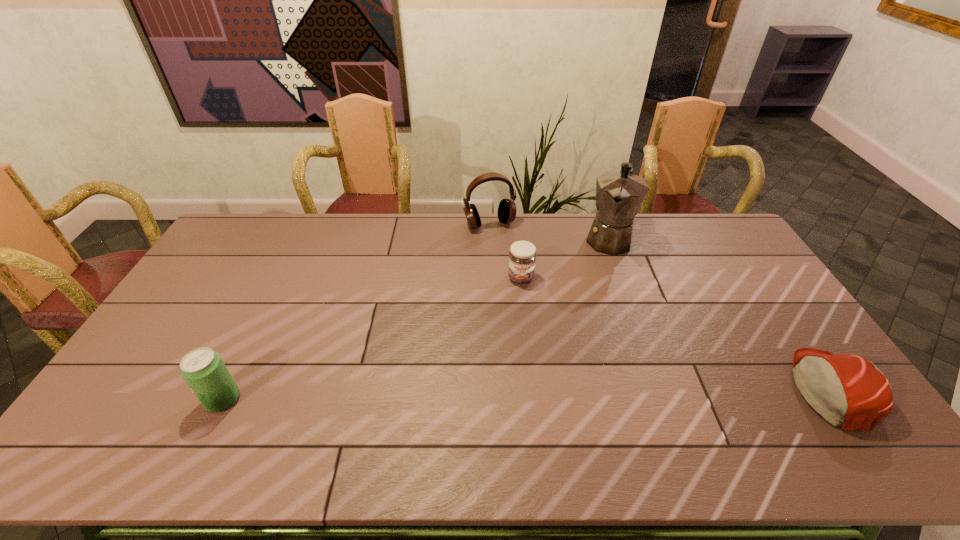
The height and width of the screenshot is (540, 960). I want to click on vacant space located 0.300m on the front label of the jam, so tap(529, 360).

The image size is (960, 540). What are the coordinates of `vacant region located 0.310m on the ear pads of the headset` in the screenshot? It's located at (523, 288).

I want to click on vacant space located on the ear pads of the headset, so click(x=532, y=305).

The width and height of the screenshot is (960, 540). What are the coordinates of `vacant area situated on the ear pads of the headset` in the screenshot? It's located at (521, 284).

Identify the location of free space located 0.050m on the pouring side of the tallest object. (604, 267).

Identify the location of free spot located on the pouring side of the tallest object. This screenshot has width=960, height=540. (593, 304).

I want to click on vacant region located on the pouring side of the tallest object, so click(589, 317).

At what (x,y) coordinates should I click in order to perform the action: click on headset situated at the far edge. Please return your answer as a coordinate pair (x, y). This screenshot has width=960, height=540. Looking at the image, I should click on (506, 213).

Locate an element on the screen. Image resolution: width=960 pixels, height=540 pixels. coffeepot that is positioned at the far edge is located at coordinates (619, 194).

At what (x,y) coordinates should I click in order to perform the action: click on soda that is at the near edge. Please return your answer as a coordinate pair (x, y). The height and width of the screenshot is (540, 960). Looking at the image, I should click on (203, 370).